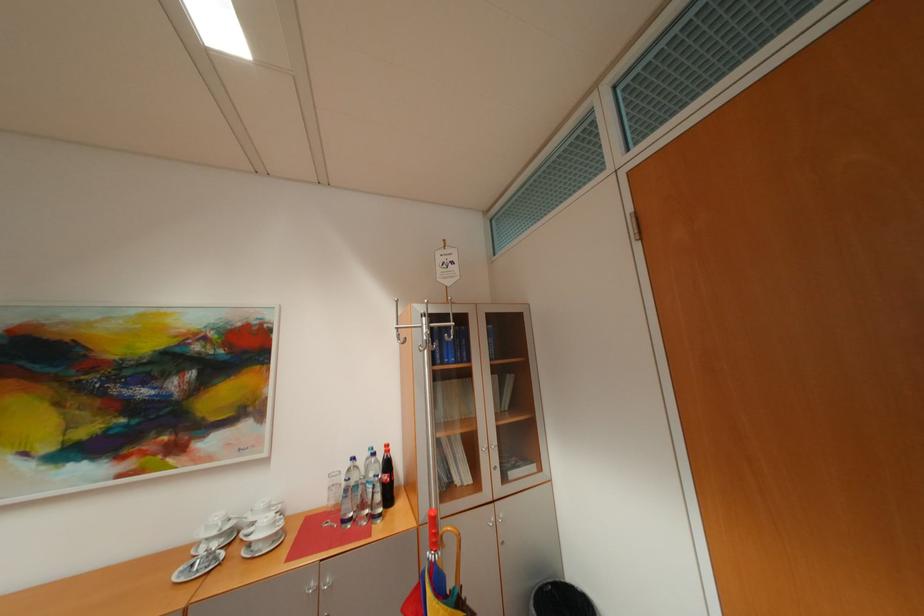
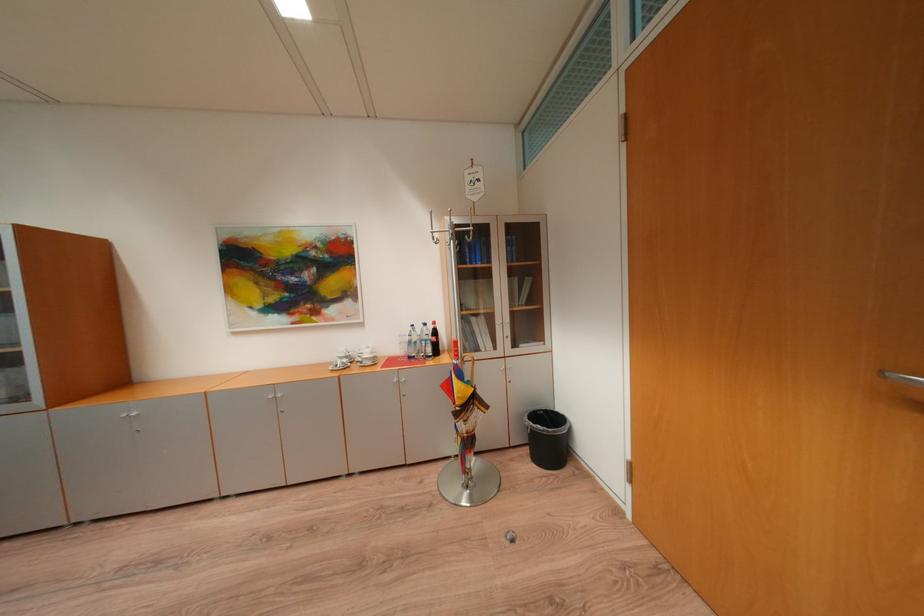
Where in the second image is the point corresponding to (x=383, y=455) from the first image?

(434, 326)